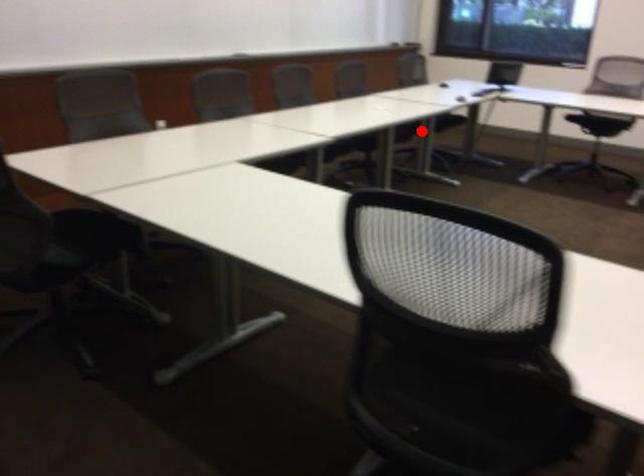
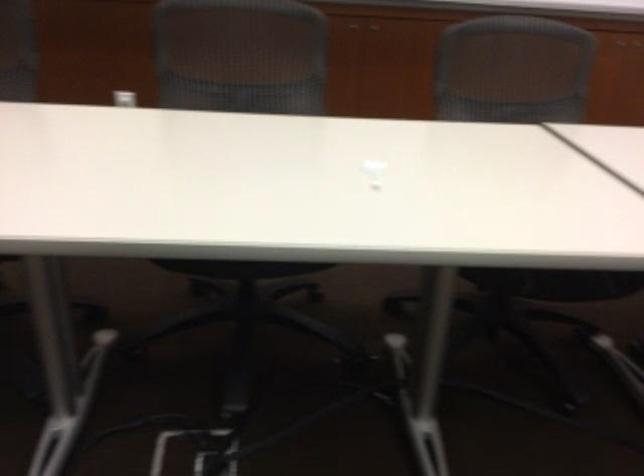
In the second image, find the point that corresponds to the highlighted location in the first image.

(556, 283)